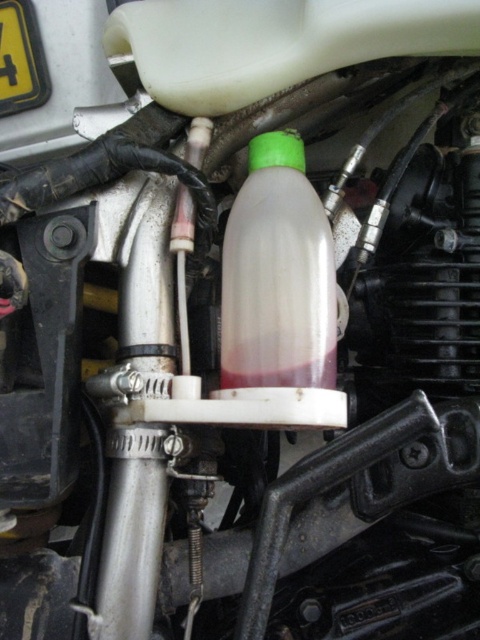
Question: Among these objects, which one is farthest from the camera?

Choices:
 (A) translucent plastic bottle at center
 (B) yellow plastic license plate at upper left

Answer: (B)

Question: Which point is farther to the camera?

Choices:
 (A) pyautogui.click(x=275, y=177)
 (B) pyautogui.click(x=9, y=26)

Answer: (B)

Question: Is translucent plastic bottle at center thinner than yellow plastic license plate at upper left?

Choices:
 (A) no
 (B) yes

Answer: (A)

Question: Which of the following is the closest to the observer?

Choices:
 (A) (301, 228)
 (B) (11, 12)

Answer: (A)

Question: Does translucent plastic bottle at center appear under yellow plastic license plate at upper left?

Choices:
 (A) no
 (B) yes

Answer: (B)

Question: Is translucent plastic bottle at center further to the viewer compared to yellow plastic license plate at upper left?

Choices:
 (A) yes
 (B) no

Answer: (B)